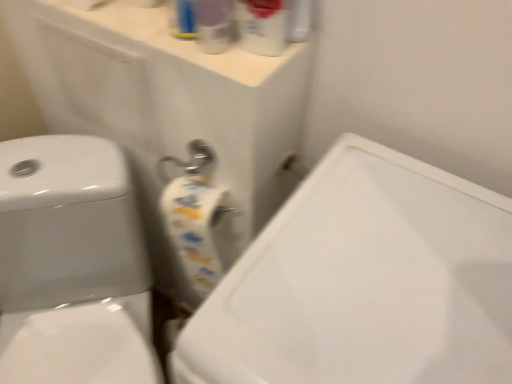
Question: Considering the relative sizes of translucent plastic spray bottle at upper center, the 1th cleaning product in the right-to-left sequence, and translucent plastic spray bottle at upper center, which ranks as the 1th cleaning product in left-to-right order, in the image provided, is translucent plastic spray bottle at upper center, the 1th cleaning product in the right-to-left sequence, thinner than translucent plastic spray bottle at upper center, which ranks as the 1th cleaning product in left-to-right order,?

Choices:
 (A) no
 (B) yes

Answer: (A)

Question: Is translucent plastic spray bottle at upper center, which is the second cleaning product from left to right, wider than translucent plastic spray bottle at upper center, which ranks as the 1th cleaning product in left-to-right order?

Choices:
 (A) yes
 (B) no

Answer: (A)

Question: Is the position of translucent plastic spray bottle at upper center, the 1th cleaning product in the right-to-left sequence, more distant than that of translucent plastic spray bottle at upper center, which ranks as the 1th cleaning product in left-to-right order?

Choices:
 (A) no
 (B) yes

Answer: (A)

Question: Would you consider translucent plastic spray bottle at upper center, the 1th cleaning product in the right-to-left sequence, to be distant from translucent plastic spray bottle at upper center, the second cleaning product when ordered from right to left?

Choices:
 (A) no
 (B) yes

Answer: (A)

Question: Can you confirm if translucent plastic spray bottle at upper center, the 1th cleaning product in the right-to-left sequence, is shorter than translucent plastic spray bottle at upper center, which ranks as the 1th cleaning product in left-to-right order?

Choices:
 (A) no
 (B) yes

Answer: (A)

Question: From a real-world perspective, relative to translucent plastic spray bottle at upper center, the 1th cleaning product in the right-to-left sequence, is white glossy sink at center vertically above or below?

Choices:
 (A) below
 (B) above

Answer: (A)

Question: Choose the correct answer: Is white glossy sink at center inside translucent plastic spray bottle at upper center, the 1th cleaning product in the right-to-left sequence, or outside it?

Choices:
 (A) inside
 (B) outside

Answer: (B)

Question: From their relative heights in the image, would you say white glossy sink at center is taller or shorter than translucent plastic spray bottle at upper center, which is the second cleaning product from left to right?

Choices:
 (A) tall
 (B) short

Answer: (A)

Question: In terms of width, does white glossy sink at center look wider or thinner when compared to translucent plastic spray bottle at upper center, which is the second cleaning product from left to right?

Choices:
 (A) wide
 (B) thin

Answer: (A)

Question: From a real-world perspective, is white glossy sink at center above or below translucent plastic spray bottle at upper center, the second cleaning product when ordered from right to left?

Choices:
 (A) below
 (B) above

Answer: (A)

Question: Is white glossy sink at center bigger or smaller than translucent plastic spray bottle at upper center, the second cleaning product when ordered from right to left?

Choices:
 (A) small
 (B) big

Answer: (B)

Question: Would you say white glossy sink at center is inside or outside translucent plastic spray bottle at upper center, which ranks as the 1th cleaning product in left-to-right order?

Choices:
 (A) inside
 (B) outside

Answer: (B)

Question: Looking at their shapes, would you say white glossy sink at center is wider or thinner than translucent plastic spray bottle at upper center, which ranks as the 1th cleaning product in left-to-right order?

Choices:
 (A) thin
 (B) wide

Answer: (B)

Question: From a real-world perspective, is translucent plastic spray bottle at upper center, which ranks as the 1th cleaning product in left-to-right order, above or below white glossy toilet at left?

Choices:
 (A) above
 (B) below

Answer: (A)

Question: Does point (216, 44) appear closer or farther from the camera than point (135, 248)?

Choices:
 (A) closer
 (B) farther

Answer: (A)